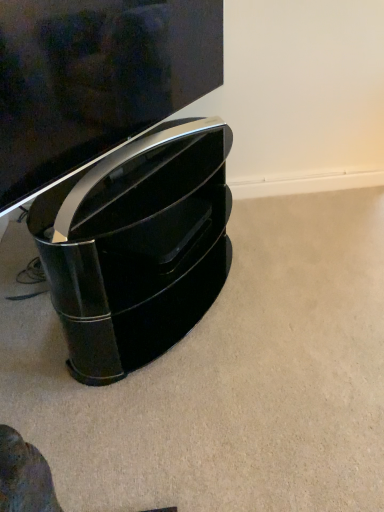
This screenshot has height=512, width=384. I want to click on free location above glossy black speaker at lower left (from a real-world perspective), so click(145, 163).